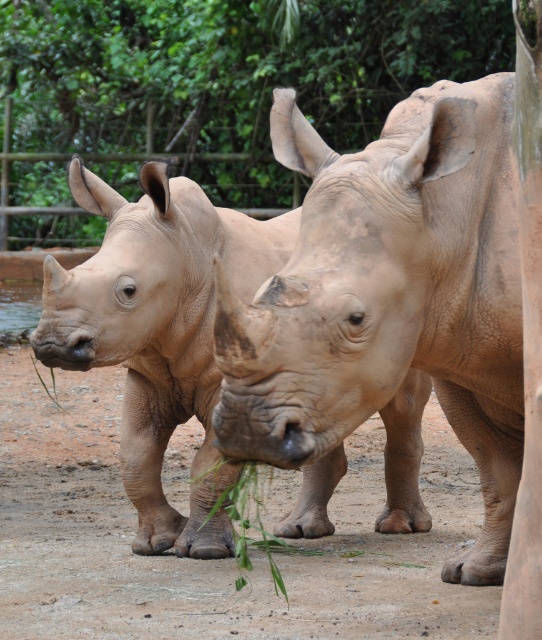
You are a zookeeper who needs to trim the vegetation in the rhinos enclosure. You see the green leafy tree at center and the green leafy plant at lower left. Which one requires more effort to trim due to its size?

The green leafy tree at center requires more effort to trim because it has a larger size compared to the green leafy plant at lower left.

You are a zookeeper who needs to ensure the matte brown rhinoceros at center can reach the green leafy plant at center for feeding. Given that the rhinoceros can stretch its neck up to 3 feet, will it be able to reach the plant?

The distance between the matte brown rhinoceros at center and the green leafy plant at center is 33.38 inches. Since 3 feet equals 36 inches, the rhinoceros can comfortably stretch its neck to reach the plant as the distance is within its reach capability.